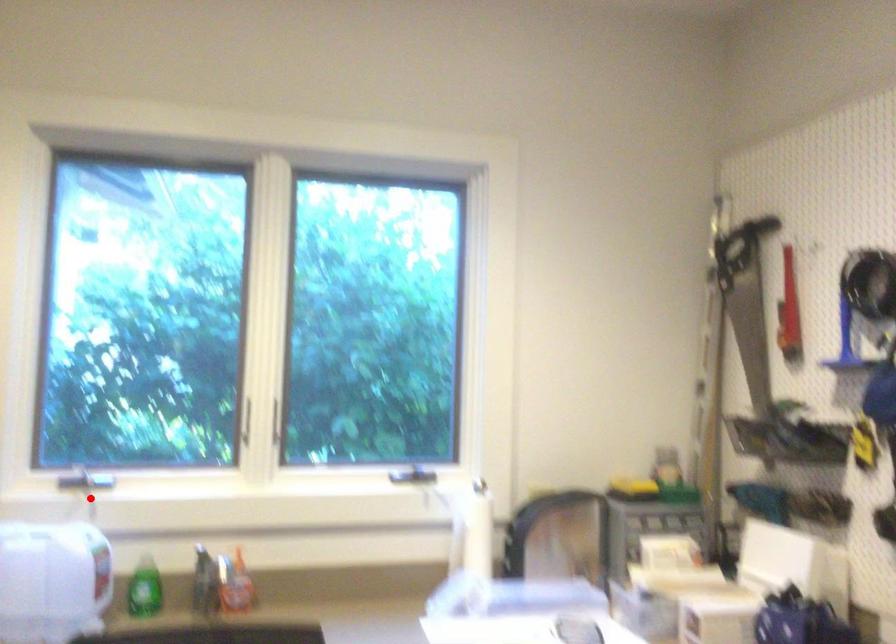
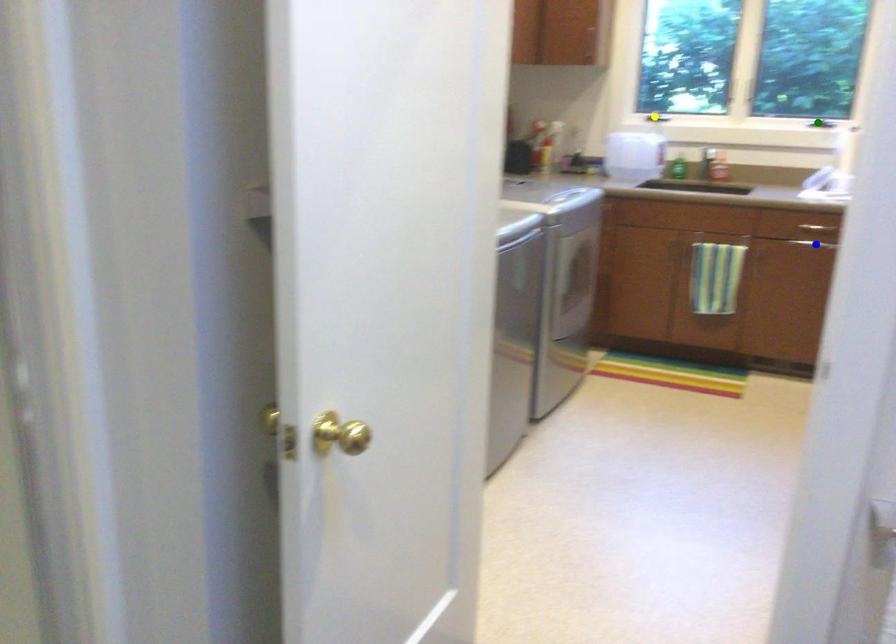
Question: I am providing you with two images of the same scene from different viewpoints. A red point is marked on the first image. You are given multiple points on the second image. Which spot in image 2 lines up with the point in image 1?

Choices:
 (A) yellow point
 (B) blue point
 (C) green point

Answer: (A)